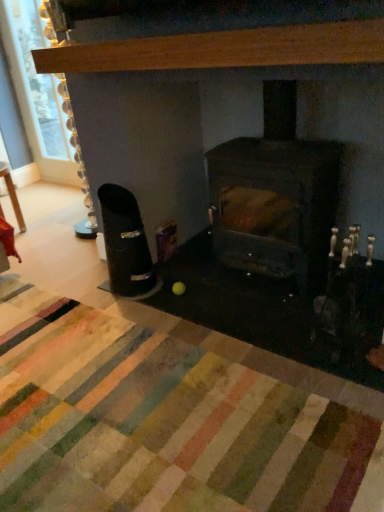
Question: Does light brown wood mantel at upper center lie behind clear glass window screen at upper left?

Choices:
 (A) yes
 (B) no

Answer: (B)

Question: From a real-world perspective, is light brown wood mantel at upper center beneath clear glass window screen at upper left?

Choices:
 (A) yes
 (B) no

Answer: (B)

Question: From the image's perspective, is light brown wood mantel at upper center on clear glass window screen at upper left?

Choices:
 (A) no
 (B) yes

Answer: (A)

Question: Does light brown wood mantel at upper center turn towards clear glass window screen at upper left?

Choices:
 (A) no
 (B) yes

Answer: (A)

Question: Considering the relative positions of light brown wood mantel at upper center and clear glass window screen at upper left in the image provided, is light brown wood mantel at upper center in front of clear glass window screen at upper left?

Choices:
 (A) no
 (B) yes

Answer: (B)

Question: From a real-world perspective, is dark brown wood burning stove at center physically located above or below wooden table at left?

Choices:
 (A) above
 (B) below

Answer: (A)

Question: Does point (314, 284) appear closer or farther from the camera than point (11, 184)?

Choices:
 (A) closer
 (B) farther

Answer: (A)

Question: Is dark brown wood burning stove at center situated inside wooden table at left or outside?

Choices:
 (A) outside
 (B) inside

Answer: (A)

Question: In terms of width, does dark brown wood burning stove at center look wider or thinner when compared to wooden table at left?

Choices:
 (A) thin
 (B) wide

Answer: (B)

Question: Based on their positions, is multicolored rug at center located to the left or right of dark brown wood burning stove at center?

Choices:
 (A) right
 (B) left

Answer: (B)

Question: Considering their positions, is multicolored rug at center located in front of or behind dark brown wood burning stove at center?

Choices:
 (A) behind
 (B) front

Answer: (B)

Question: From a real-world perspective, relative to dark brown wood burning stove at center, is multicolored rug at center vertically above or below?

Choices:
 (A) below
 (B) above

Answer: (A)

Question: Considering the positions of multicolored rug at center and dark brown wood burning stove at center in the image, is multicolored rug at center taller or shorter than dark brown wood burning stove at center?

Choices:
 (A) tall
 (B) short

Answer: (B)

Question: Is point (13, 32) closer or farther from the camera than point (339, 57)?

Choices:
 (A) farther
 (B) closer

Answer: (A)

Question: Choose the correct answer: Is clear glass window screen at upper left inside light brown wood mantel at upper center or outside it?

Choices:
 (A) outside
 (B) inside

Answer: (A)